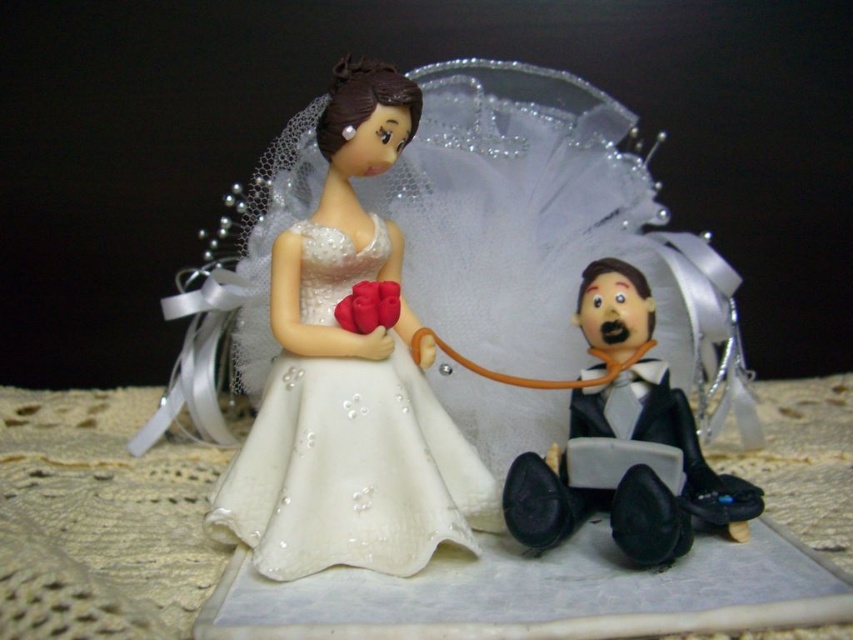
Question: Which point appears farthest from the camera in this image?

Choices:
 (A) click(x=354, y=193)
 (B) click(x=610, y=314)

Answer: (A)

Question: Does satin white dress at upper left lie in front of black glossy suit at lower right?

Choices:
 (A) yes
 (B) no

Answer: (B)

Question: Can you confirm if satin white dress at upper left is smaller than black glossy suit at lower right?

Choices:
 (A) no
 (B) yes

Answer: (A)

Question: Which of the following is the farthest from the observer?

Choices:
 (A) (323, 214)
 (B) (616, 420)

Answer: (A)

Question: Does satin white dress at upper left appear over black glossy suit at lower right?

Choices:
 (A) yes
 (B) no

Answer: (A)

Question: Which point is closer to the camera taking this photo?

Choices:
 (A) (230, 472)
 (B) (610, 419)

Answer: (A)